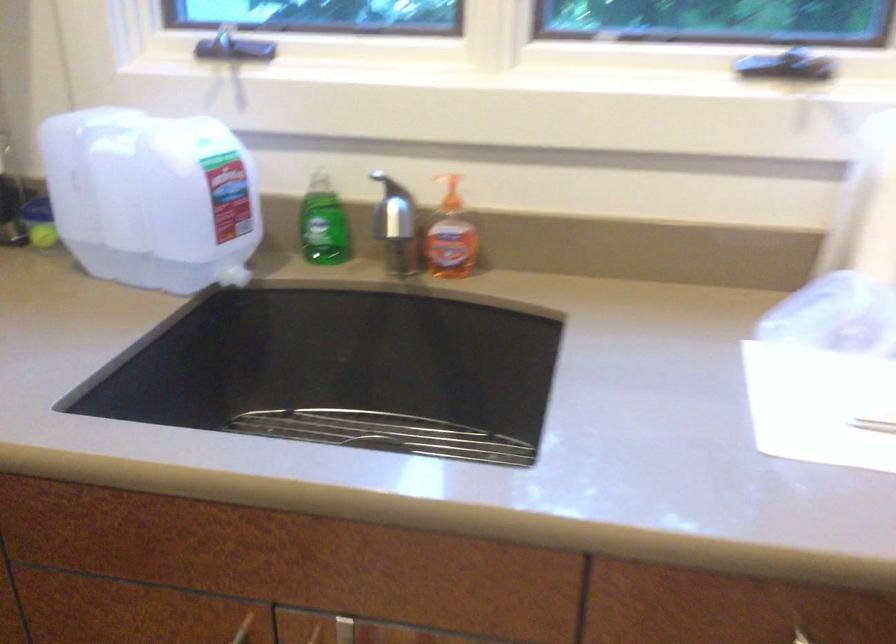
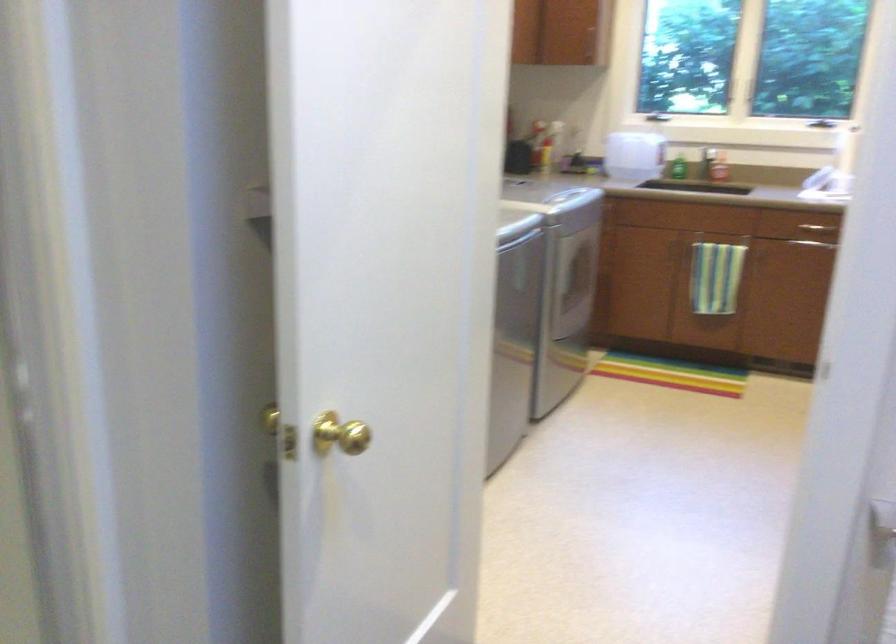
Where in the second image is the point corresponding to pixel 123 245 from the first image?

(633, 155)